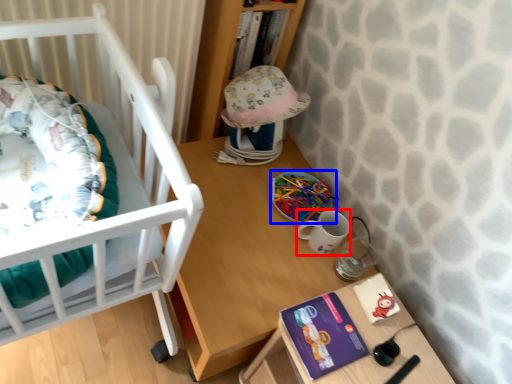
Question: Among these objects, which one is farthest to the camera, mug (highlighted by a red box) or toy (highlighted by a blue box)?

Choices:
 (A) mug
 (B) toy

Answer: (B)